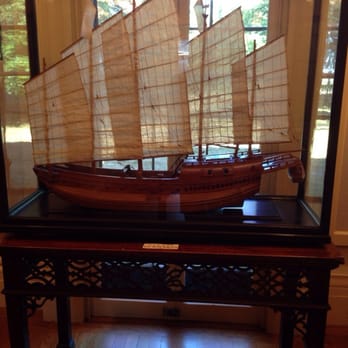
I want to click on wood floor below, so click(86, 334).